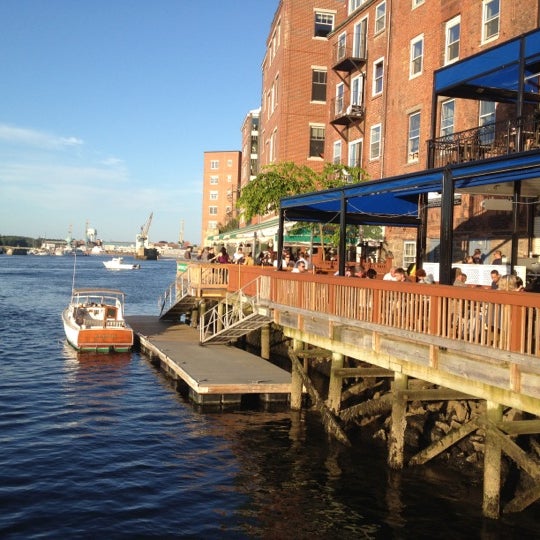
The width and height of the screenshot is (540, 540). Find the location of `restaurant seating area`. restaurant seating area is located at coordinates (474, 280).